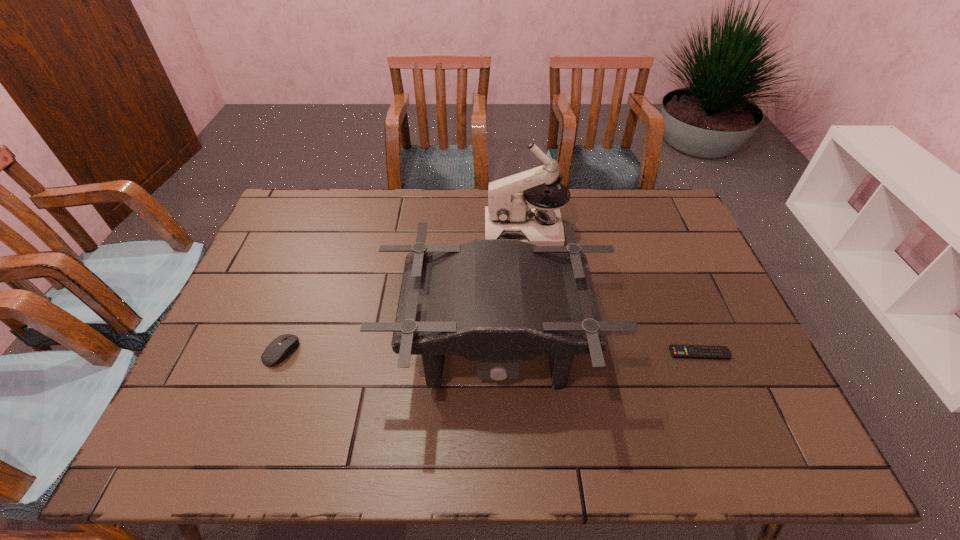
The height and width of the screenshot is (540, 960). I want to click on vacant space located with a camera mounted on the underside of the drone, so click(x=498, y=447).

This screenshot has width=960, height=540. In order to click on blank space located on the right of the leftmost object in this screenshot , I will do `click(336, 352)`.

Find the location of a particular element. The height and width of the screenshot is (540, 960). free space located on the left of the remote control is located at coordinates (561, 353).

Where is `object that is at the far edge`? object that is at the far edge is located at coordinates (509, 215).

The image size is (960, 540). In order to click on object at the near edge in this screenshot , I will do `click(496, 301)`.

Identify the location of object positioned at the left edge. Image resolution: width=960 pixels, height=540 pixels. (283, 346).

Where is `object located at the right edge`? The height and width of the screenshot is (540, 960). object located at the right edge is located at coordinates (677, 351).

In the image, there is a desktop. Where is `vacant space at the far edge`? This screenshot has width=960, height=540. vacant space at the far edge is located at coordinates (620, 199).

Image resolution: width=960 pixels, height=540 pixels. I want to click on free space at the near edge of the desktop, so click(413, 426).

The height and width of the screenshot is (540, 960). In order to click on vacant space at the left edge of the desktop in this screenshot , I will do `click(229, 323)`.